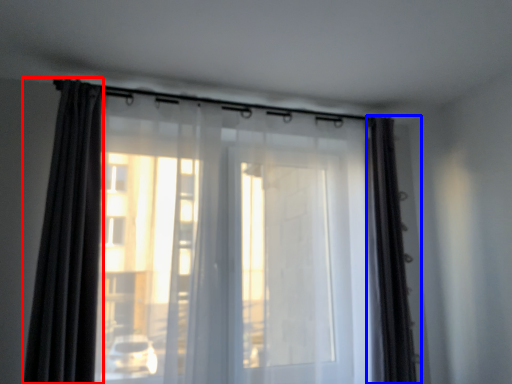
Question: Which object is closer to the camera taking this photo, curtain (highlighted by a red box) or curtain (highlighted by a blue box)?

Choices:
 (A) curtain
 (B) curtain

Answer: (A)